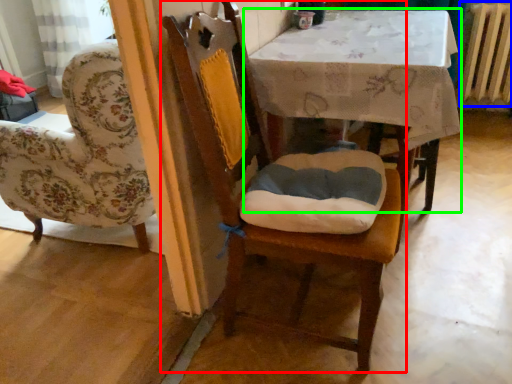
Question: Estimate the real-world distances between objects in this image. Which object is farther from chair (highlighted by a red box), radiator (highlighted by a blue box) or table (highlighted by a green box)?

Choices:
 (A) radiator
 (B) table

Answer: (A)